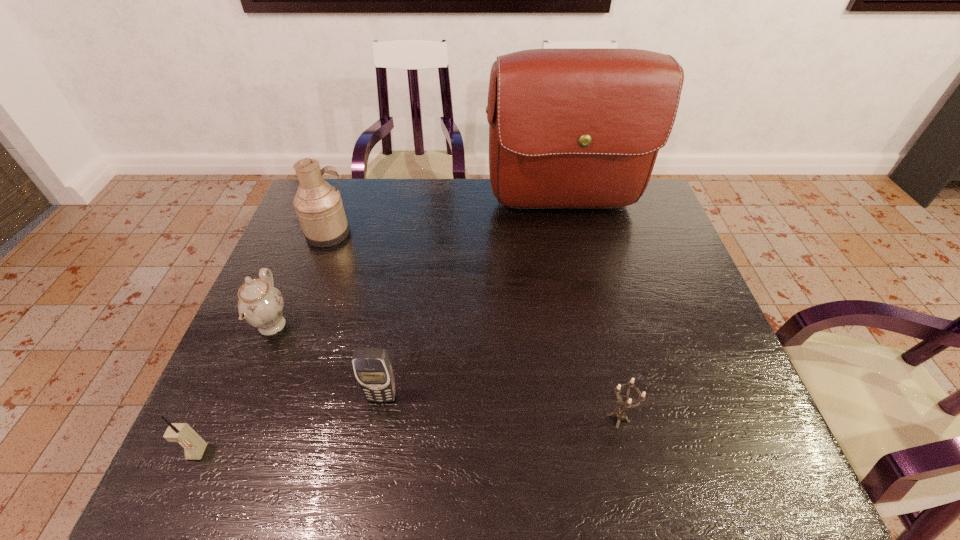
This screenshot has width=960, height=540. In order to click on vacant region located on the back of the second tallest object in this screenshot , I will do `click(340, 204)`.

This screenshot has height=540, width=960. I want to click on vacant space situated 0.130m on the front face of the farther cellular telephone, so click(x=370, y=467).

Where is `blank space located on the spout of the fourth nearest object`? blank space located on the spout of the fourth nearest object is located at coordinates (346, 326).

Where is `vacant area situated on the back of the candle holder`? The image size is (960, 540). vacant area situated on the back of the candle holder is located at coordinates (601, 343).

This screenshot has height=540, width=960. I want to click on satchel that is at the far edge, so click(x=568, y=127).

Locate an element on the screen. Image resolution: width=960 pixels, height=540 pixels. pitcher situated at the far edge is located at coordinates (318, 205).

What are the coordinates of `object at the near edge` in the screenshot? It's located at (194, 446).

Find the location of `pitcher at the left edge`. pitcher at the left edge is located at coordinates (318, 205).

You are a GUI agent. You are given a task and a screenshot of the screen. Output one action in this format:
    pyautogui.click(x=<x>, y=<y>)
    Task: Click on the chinaware positioned at the left edge
    This screenshot has width=960, height=540.
    Given the screenshot: What is the action you would take?
    pyautogui.click(x=260, y=304)

This screenshot has width=960, height=540. What are the coordinates of `cellular telephone located in the left edge section of the desktop` in the screenshot? It's located at point(194,446).